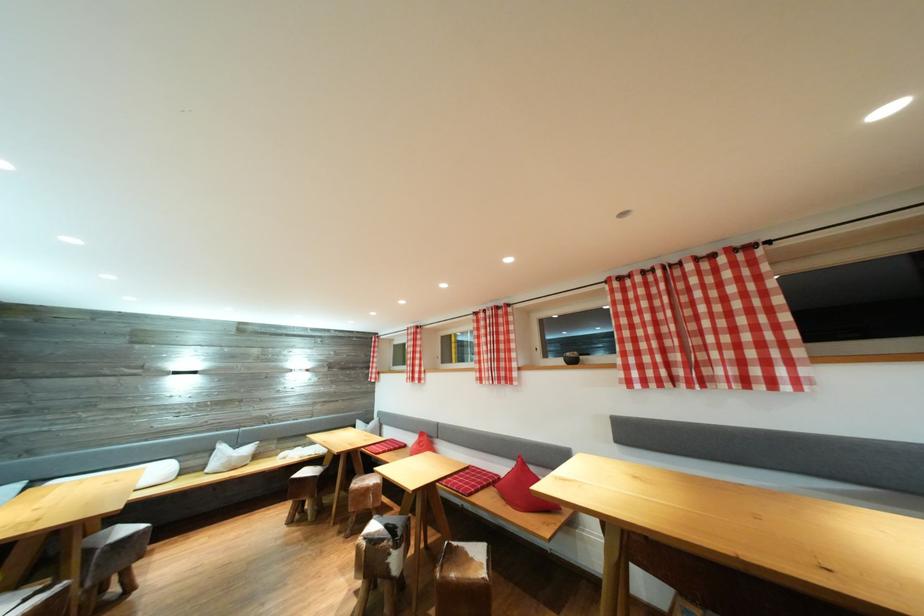
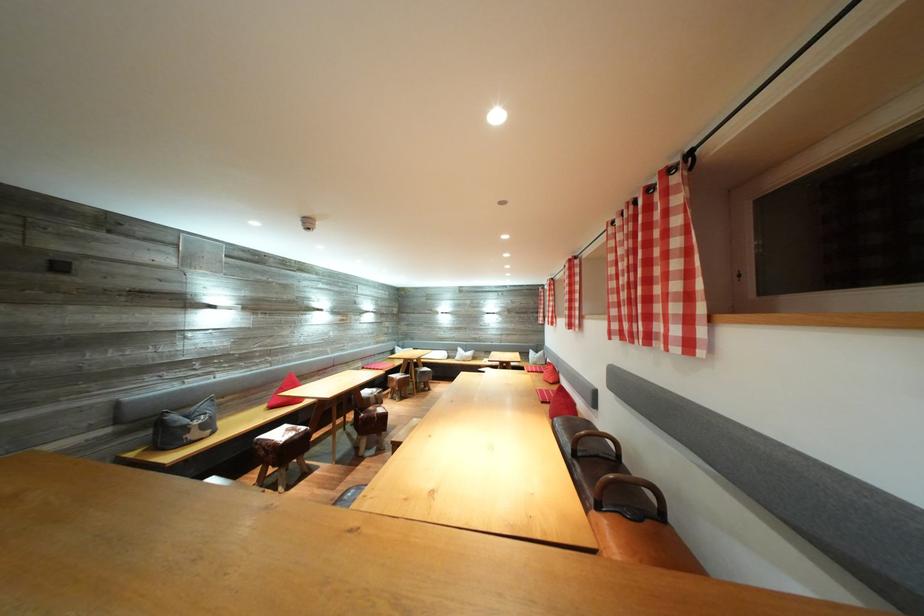
Find the pixel in the second image that matches pixel 432 444 in the first image.

(557, 373)